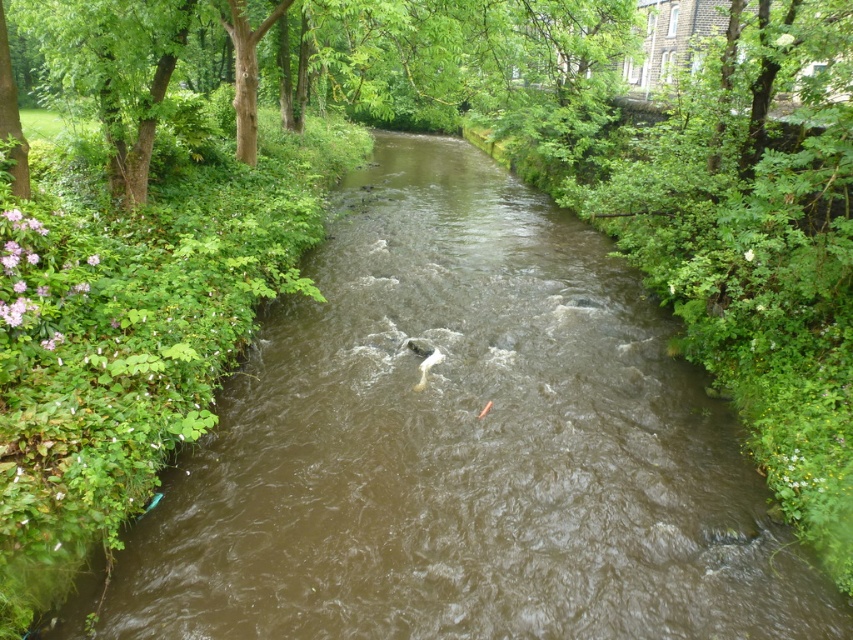
Is point (525, 49) positioned after point (439, 360)?

Yes, it is.

Which of these two, green leafy tree at upper center or white matte fish at center, stands shorter?

With less height is white matte fish at center.

Which is behind, point (132, 177) or point (421, 362)?

Positioned behind is point (132, 177).

The width and height of the screenshot is (853, 640). What are the coordinates of `green leafy tree at upper center` in the screenshot? It's located at (318, 58).